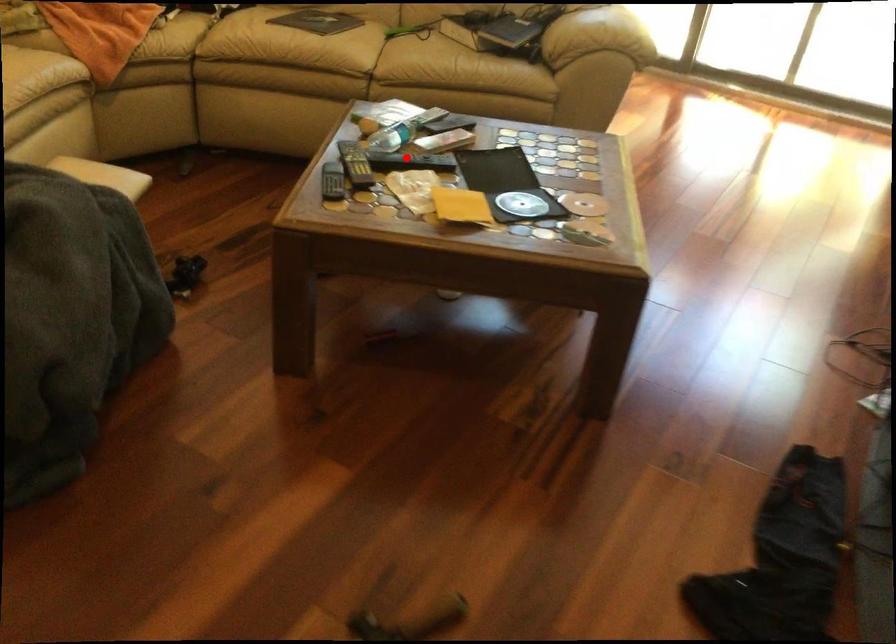
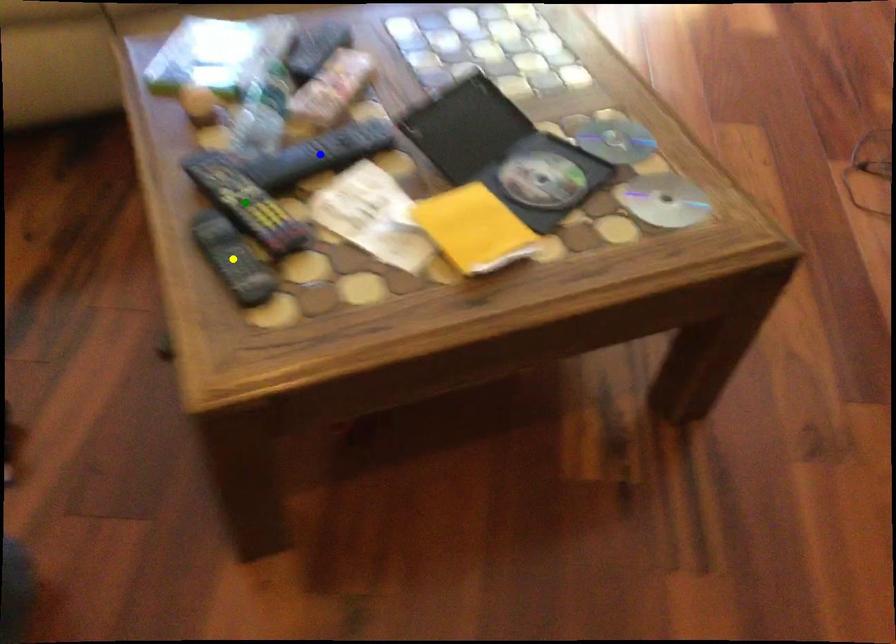
Question: I am providing you with two images of the same scene from different viewpoints. A red point is marked on the first image. You are given multiple points on the second image. Which spot in image 2 lines up with the point in image 1?

Choices:
 (A) yellow point
 (B) green point
 (C) blue point

Answer: (C)